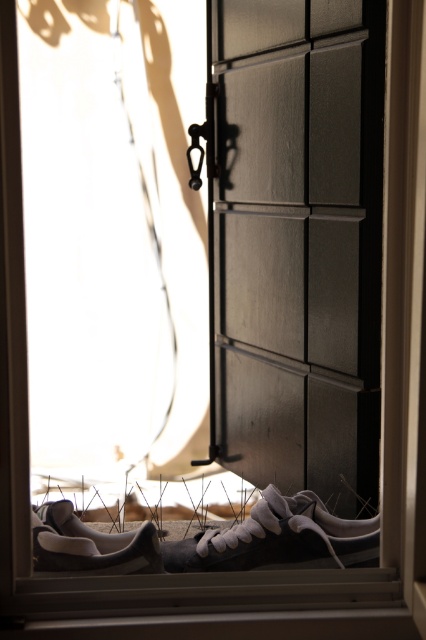
You are standing inside a room and want to exit through the matte black door at center. However, there is a white suede shoe at lower left in your way. Can you walk through the door without moving the shoe?

The white suede shoe at lower left is behind the matte black door at center, so it is not blocking your path to the door. You can walk through the matte black door at center without moving the shoe.